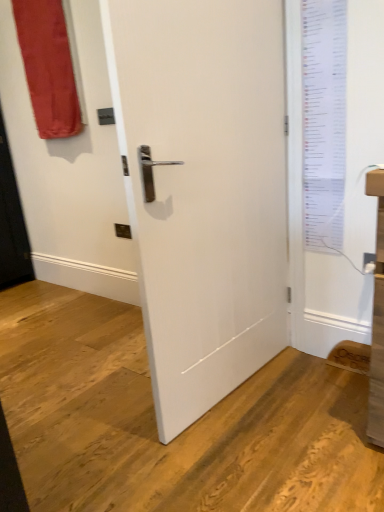
What is the approximate height of white matte door at center?

It is 1.52 meters.

Image resolution: width=384 pixels, height=512 pixels. Identify the location of white paper list at upper right. (324, 121).

From a real-world perspective, who is located lower, white matte door at center or matte red curtain at upper left?

From a 3D spatial view, white matte door at center is below.

Considering the sizes of objects white matte door at center and matte red curtain at upper left in the image provided, who is smaller, white matte door at center or matte red curtain at upper left?

Smaller between the two is matte red curtain at upper left.

Which is more to the right, white matte door at center or matte red curtain at upper left?

white matte door at center is more to the right.

Is point (188, 61) closer or farther from the camera than point (42, 71)?

Point (188, 61) appears to be closer to the viewer than point (42, 71).

Which object is thinner, white paper list at upper right or matte red curtain at upper left?

Thinner between the two is white paper list at upper right.

Between white paper list at upper right and matte red curtain at upper left, which one has larger size?

With larger size is matte red curtain at upper left.

From the image's perspective, does white paper list at upper right appear lower than matte red curtain at upper left?

Yes.

Does point (311, 32) appear closer or farther from the camera than point (36, 44)?

Point (311, 32) appears to be closer to the viewer than point (36, 44).

Between white paper list at upper right and white matte door at center, which one has less height?

white paper list at upper right is shorter.

Is white paper list at upper right thinner than white matte door at center?

Yes, white paper list at upper right is thinner than white matte door at center.

Looking at the image, does white paper list at upper right seem bigger or smaller compared to white matte door at center?

Considering their sizes, white paper list at upper right takes up less space than white matte door at center.

From a real-world perspective, is white paper list at upper right located beneath white matte door at center?

Incorrect, from a real-world perspective, white paper list at upper right is higher than white matte door at center.

From the image's perspective, is matte red curtain at upper left over white matte door at center?

Yes.

Consider the image. Is matte red curtain at upper left in contact with white matte door at center?

matte red curtain at upper left is not next to white matte door at center, and they're not touching.

Is point (63, 122) in front of point (177, 211)?

No, it is behind (177, 211).

Considering the relative positions of white matte door at center and white paper list at upper right in the image provided, is white matte door at center to the right of white paper list at upper right from the viewer's perspective?

In fact, white matte door at center is to the left of white paper list at upper right.

Is white matte door at center completely or partially outside of white paper list at upper right?

Absolutely, white matte door at center is external to white paper list at upper right.

Based on the photo, from the image's perspective, which is above, white matte door at center or white paper list at upper right?

white paper list at upper right.

Can you confirm if white matte door at center is shorter than white paper list at upper right?

Incorrect, the height of white matte door at center does not fall short of that of white paper list at upper right.

Does matte red curtain at upper left have a greater height compared to white paper list at upper right?

No, matte red curtain at upper left is not taller than white paper list at upper right.

Is matte red curtain at upper left to the right of white paper list at upper right from the viewer's perspective?

Incorrect, matte red curtain at upper left is not on the right side of white paper list at upper right.

Is matte red curtain at upper left with white paper list at upper right?

No, matte red curtain at upper left is not next to white paper list at upper right.

Is point (51, 74) more distant than point (313, 165)?

That is True.

The image size is (384, 512). Find the location of `curtain above the white matte door at center (from the image's perspective)`. curtain above the white matte door at center (from the image's perspective) is located at coordinates (48, 67).

Where is `curtain on the left of white paper list at upper right`? This screenshot has height=512, width=384. curtain on the left of white paper list at upper right is located at coordinates (48, 67).

From the image, which object appears to be farther from matte red curtain at upper left, white paper list at upper right or white matte door at center?

white paper list at upper right is positioned further to the anchor matte red curtain at upper left.

Estimate the real-world distances between objects in this image. Which object is further from white paper list at upper right, matte red curtain at upper left or white matte door at center?

matte red curtain at upper left.

Considering their positions, is white paper list at upper right positioned further to white matte door at center than matte red curtain at upper left?

The object further to white matte door at center is matte red curtain at upper left.

Which object lies further to the anchor point white paper list at upper right, white matte door at center or matte red curtain at upper left?

matte red curtain at upper left is positioned further to the anchor white paper list at upper right.

From the image, which object appears to be nearer to matte red curtain at upper left, white matte door at center or white paper list at upper right?

Among the two, white matte door at center is located nearer to matte red curtain at upper left.

Based on the photo, looking at the image, which one is located further to white matte door at center, matte red curtain at upper left or white paper list at upper right?

matte red curtain at upper left.

I want to click on door between matte red curtain at upper left and white paper list at upper right from left to right, so click(x=203, y=190).